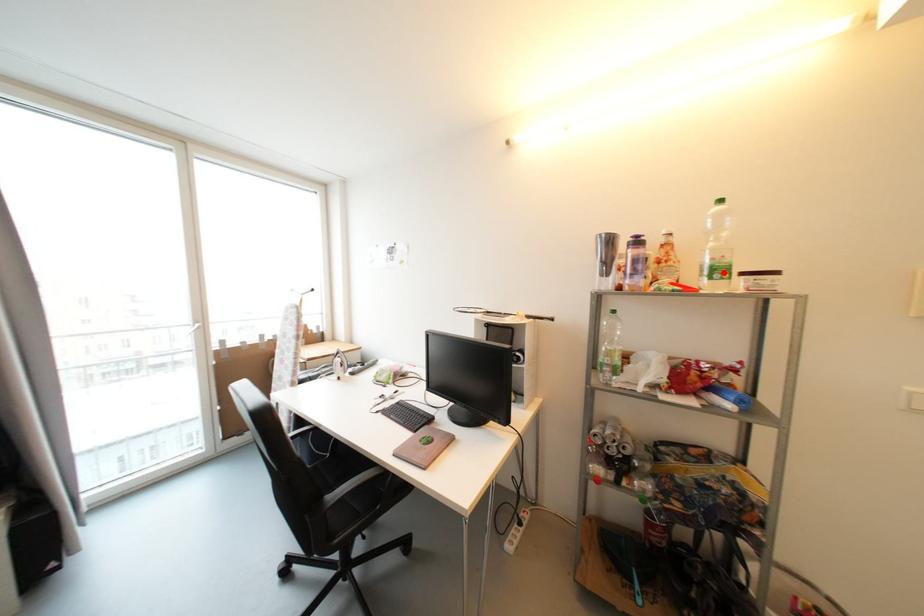
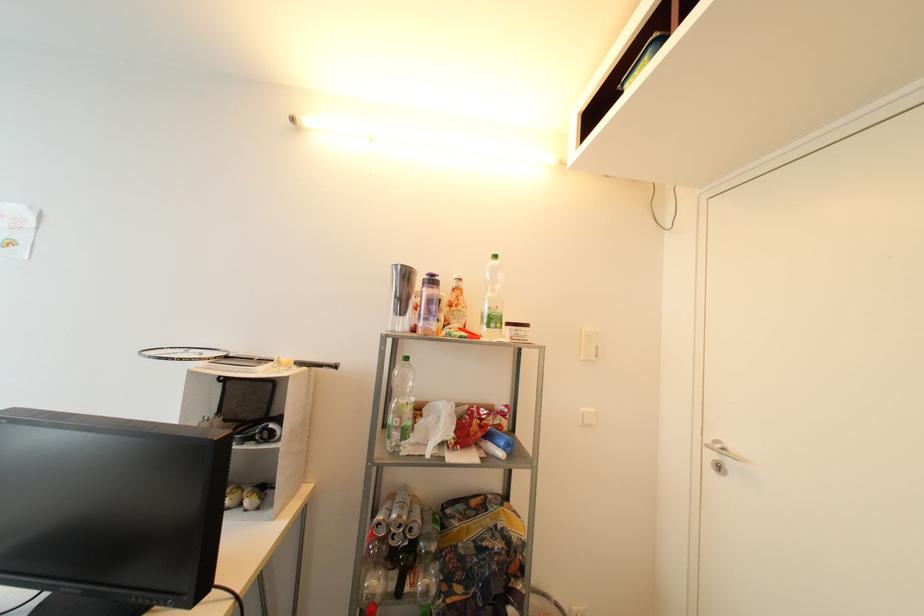
Locate, in the second image, the point that corresponds to the highlighted location in the first image.

(499, 322)